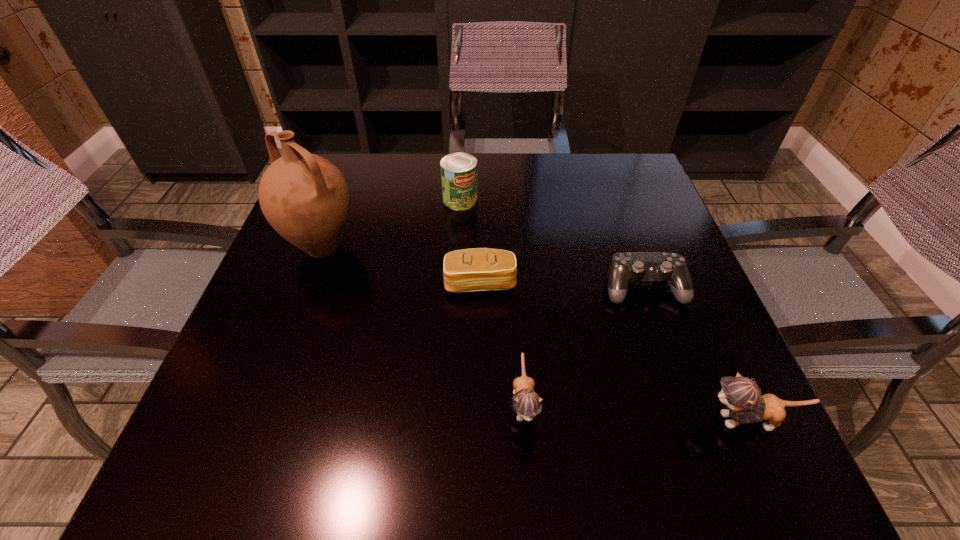
The height and width of the screenshot is (540, 960). Find the location of `vacant space at the far edge of the desktop`. vacant space at the far edge of the desktop is located at coordinates (552, 171).

Identify the location of free location at the near edge. This screenshot has width=960, height=540. (511, 401).

You are a GUI agent. You are given a task and a screenshot of the screen. Output one action in this format:
    pyautogui.click(x=<x>, y=<y>)
    Task: Click on the free space at the left edge
    This screenshot has height=540, width=960.
    Given the screenshot: What is the action you would take?
    pyautogui.click(x=345, y=240)

This screenshot has height=540, width=960. In order to click on vacant area at the right edge of the desktop in this screenshot , I will do tap(635, 340).

This screenshot has height=540, width=960. I want to click on blank space at the near right corner, so click(x=671, y=400).

This screenshot has height=540, width=960. Find the location of `empty space between the right kitten and the clutch bag`. empty space between the right kitten and the clutch bag is located at coordinates (614, 352).

Identify the location of vacant space in between the taller kitten and the farthest object. (605, 310).

Identify the location of free space that is in between the farthest object and the clutch bag. This screenshot has width=960, height=540. (470, 241).

Find the location of a particular element. unoccupied area between the control and the taller kitten is located at coordinates (696, 354).

Find the location of `vacant region between the control and the shorter kitten`. vacant region between the control and the shorter kitten is located at coordinates (584, 345).